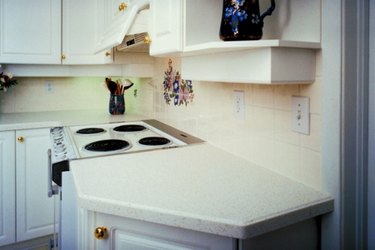
The height and width of the screenshot is (250, 375). Identify the location of bottom right burner. tap(114, 146).